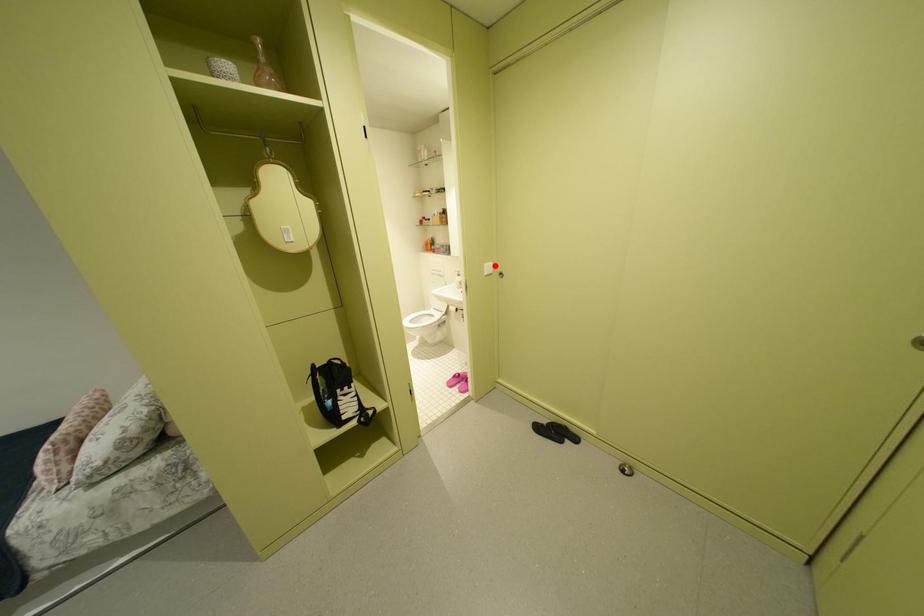
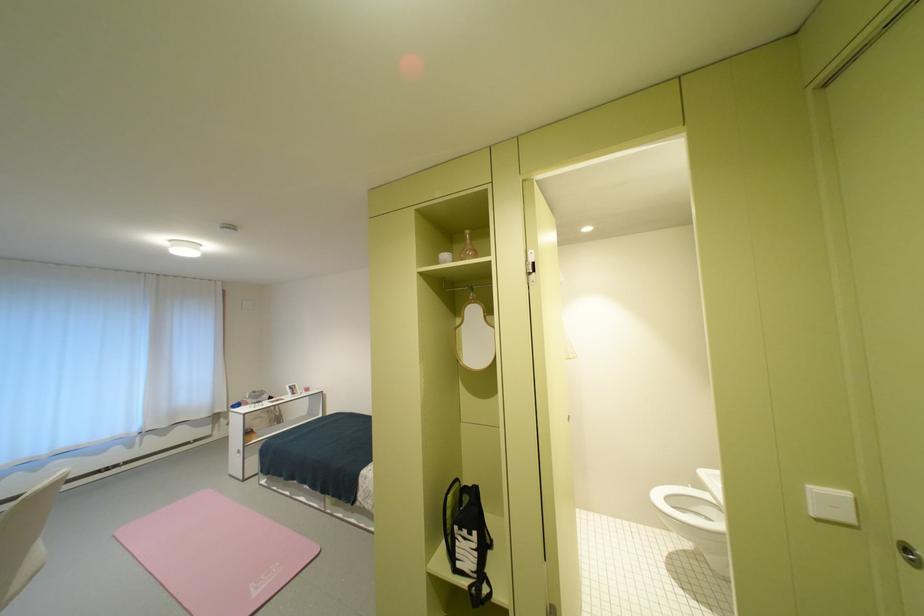
Locate, in the second image, the point that corresponds to the highlighted location in the first image.

(821, 488)